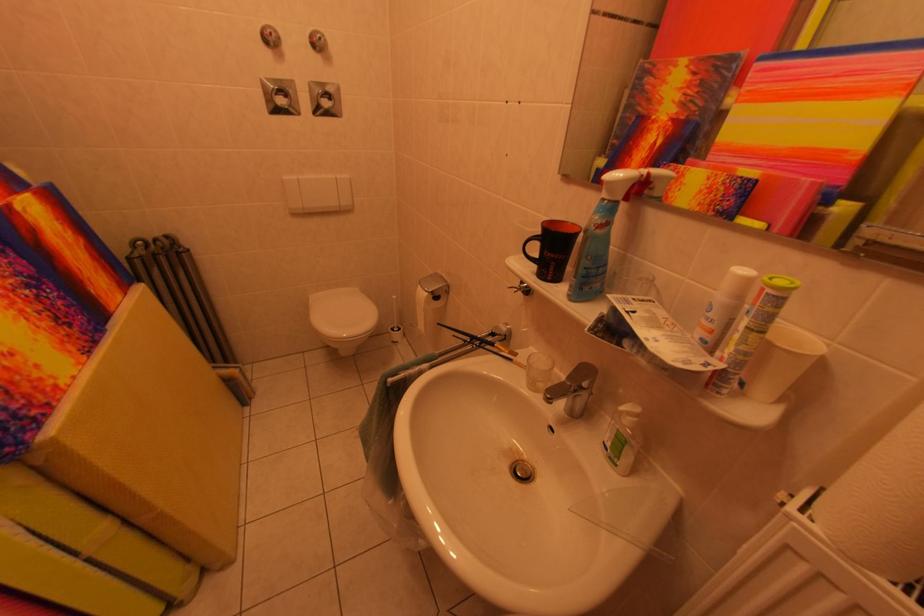
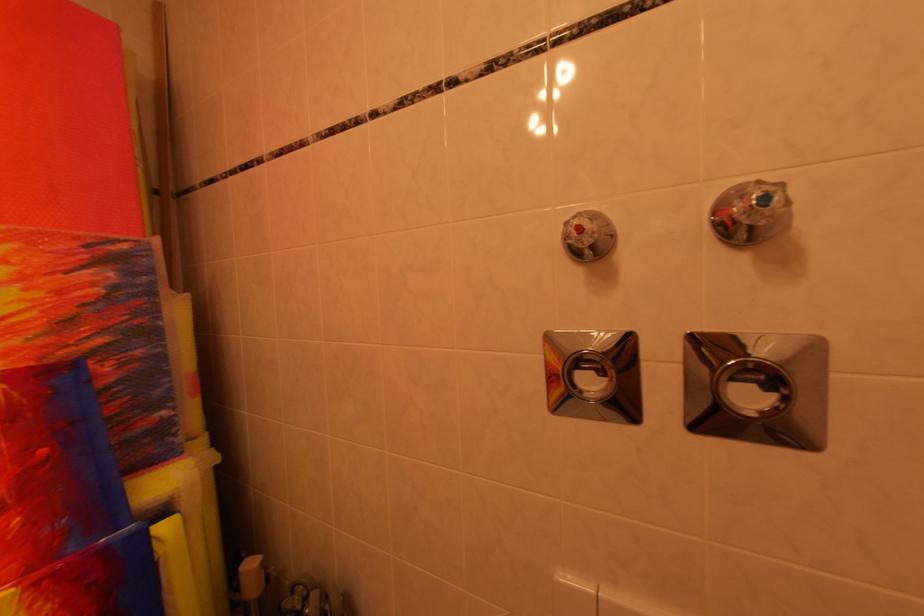
Locate, in the second image, the point that corresponds to point (327, 44) in the first image.

(773, 201)